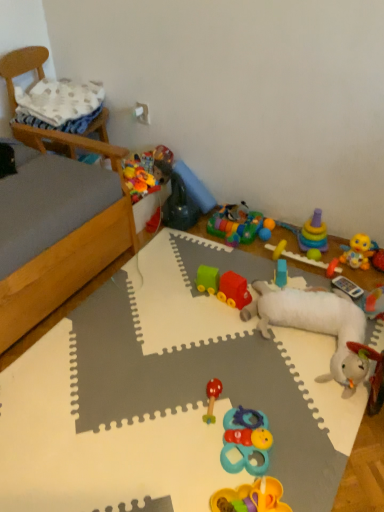
Identify the location of free area below multicolored plastic toy at upper right, the fifth toy when ordered from top to bottom (from a real-world perspective). This screenshot has width=384, height=512. (315, 268).